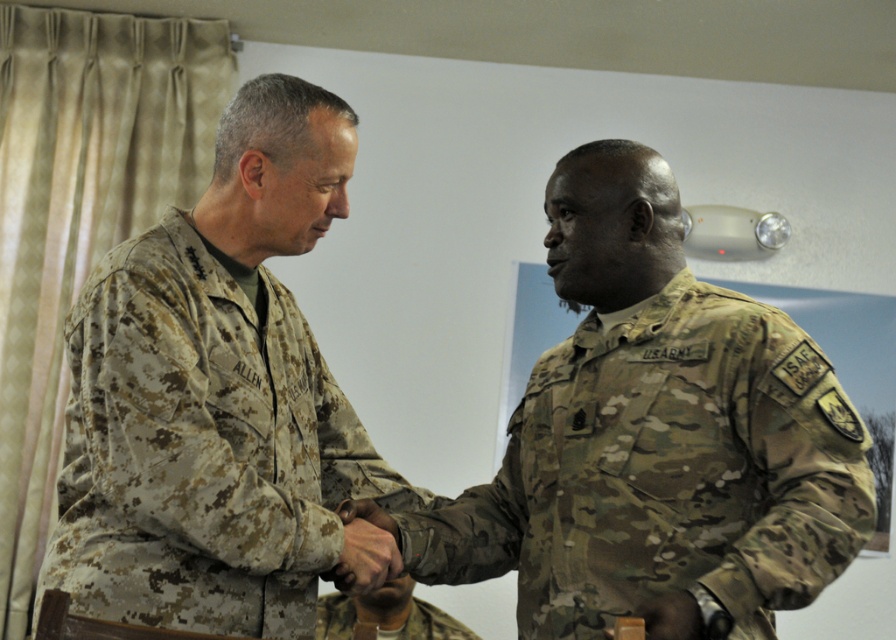
Which is more to the right, camouflage uniform at center or camouflage uniform at left?

camouflage uniform at center

Image resolution: width=896 pixels, height=640 pixels. I want to click on camouflage uniform at center, so point(653,440).

Which of these two, camouflage uniform at left or camouflage fabric uniform at center, stands taller?

Standing taller between the two is camouflage uniform at left.

Identify the location of camouflage uniform at left. Image resolution: width=896 pixels, height=640 pixels. (220, 400).

Between point (145, 506) and point (333, 596), which one is positioned behind?

Point (333, 596)

This screenshot has height=640, width=896. I want to click on camouflage uniform at left, so click(x=220, y=400).

From the picture: Is camouflage uniform at center to the left of camouflage fabric uniform at center from the viewer's perspective?

Incorrect, camouflage uniform at center is not on the left side of camouflage fabric uniform at center.

Is camouflage uniform at center above camouflage fabric uniform at center?

Yes, camouflage uniform at center is above camouflage fabric uniform at center.

Is point (608, 227) farther from viewer compared to point (382, 600)?

No, (608, 227) is in front of (382, 600).

Locate an element on the screen. The width and height of the screenshot is (896, 640). camouflage uniform at center is located at coordinates (653, 440).